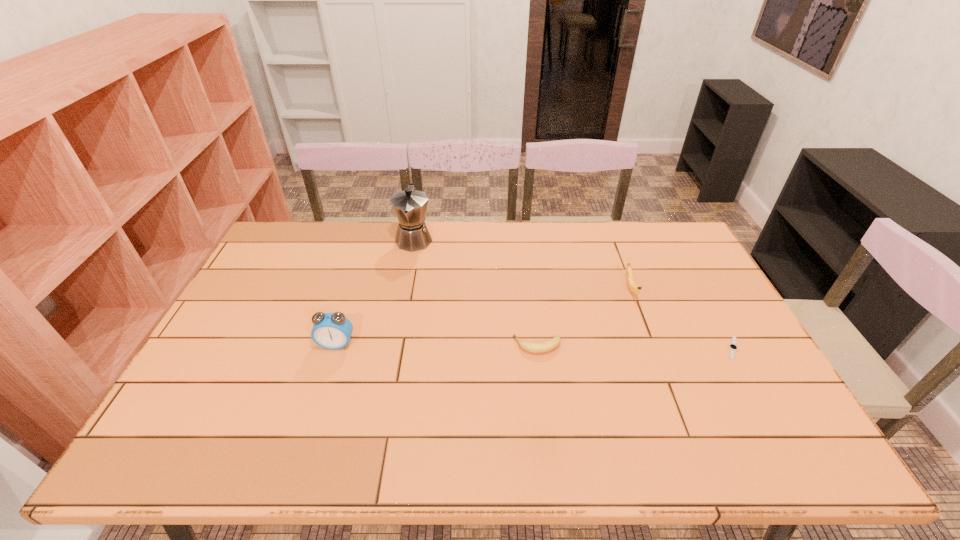
Identify the location of free spot between the watch and the tallest object. (573, 293).

At what (x,y) coordinates should I click in order to perform the action: click on vacant area that lies between the farther banana and the coffeepot. Please return your answer as a coordinate pair (x, y). Looking at the image, I should click on (522, 264).

This screenshot has width=960, height=540. I want to click on vacant region between the taller banana and the rightmost object, so [x=682, y=319].

Image resolution: width=960 pixels, height=540 pixels. Identify the location of vacant space in between the farther banana and the leftmost object. (484, 316).

Choose which object is the third nearest neighbor to the tallest object. Please provide its 2D coordinates. Your answer should be formatted as a tuple, i.e. [(x, y)], where the tuple contains the x and y coordinates of a point satisfying the conditions above.

[(632, 286)]

Choose which object is the fourth nearest neighbor to the farthest object. Please provide its 2D coordinates. Your answer should be formatted as a tuple, i.e. [(x, y)], where the tuple contains the x and y coordinates of a point satisfying the conditions above.

[(732, 346)]

Where is `free space that satisfies the following two spatial constraints: 1. at the stem of the rightmost object; 2. on the right side of the fourth tallest object`? Image resolution: width=960 pixels, height=540 pixels. free space that satisfies the following two spatial constraints: 1. at the stem of the rightmost object; 2. on the right side of the fourth tallest object is located at coordinates (538, 348).

Where is `free spot that satisfies the following two spatial constraints: 1. at the stem of the shortest object; 2. on the right side of the shorter banana`? The image size is (960, 540). free spot that satisfies the following two spatial constraints: 1. at the stem of the shortest object; 2. on the right side of the shorter banana is located at coordinates (538, 348).

You are a GUI agent. You are given a task and a screenshot of the screen. Output one action in this format:
    pyautogui.click(x=<x>, y=<y>)
    Task: Click on the vacant region that satisfies the following two spatial constraints: 1. at the stem of the rightmost object; 2. on the left side of the third object from left to right
    The image size is (960, 540).
    Given the screenshot: What is the action you would take?
    pyautogui.click(x=538, y=348)

Find the location of a particular element. This screenshot has width=960, height=540. vacant space that satisfies the following two spatial constraints: 1. at the spout of the shortest object; 2. on the left side of the coffeepot is located at coordinates (394, 348).